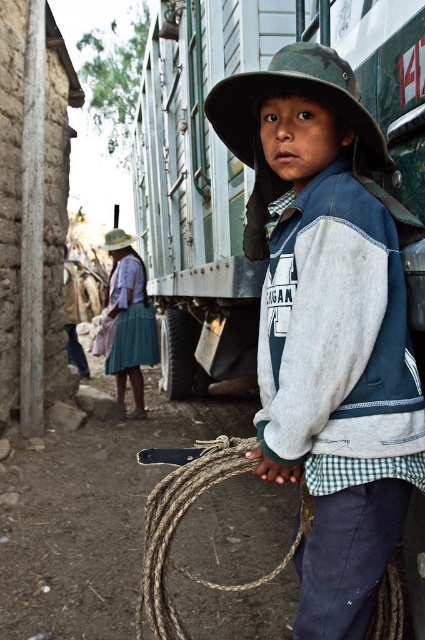
Question: Does green painted metal train car at center have a smaller size compared to white matte hat at upper center?

Choices:
 (A) no
 (B) yes

Answer: (A)

Question: Is the position of green painted metal train car at center less distant than that of brown rough rope at lower center?

Choices:
 (A) no
 (B) yes

Answer: (A)

Question: Among these objects, which one is farthest from the camera?

Choices:
 (A) green painted metal train car at center
 (B) denim jacket at center

Answer: (A)

Question: Which point is closer to the camera taking this photo?

Choices:
 (A) (291, 86)
 (B) (240, 324)
 (C) (121, 246)
 (D) (175, 632)

Answer: (A)

Question: Observing the image, what is the correct spatial positioning of denim jacket at center in reference to camo fabric hat at center?

Choices:
 (A) below
 (B) above

Answer: (A)

Question: Which of the following is the closest to the observer?

Choices:
 (A) (255, 422)
 (B) (204, 458)

Answer: (B)